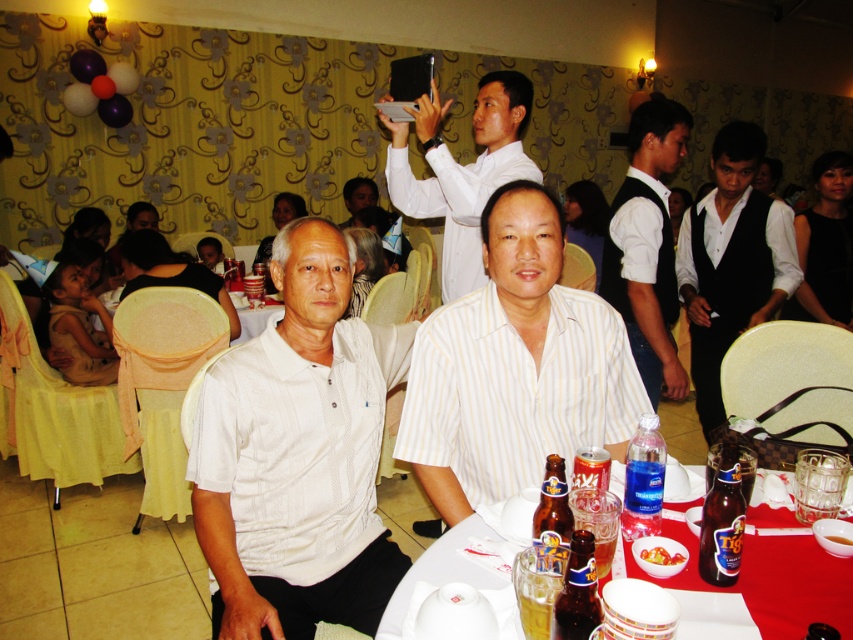
Between black satin vest at right and translucent plastic cups at lower center, which one has less height?

translucent plastic cups at lower center is shorter.

At what (x,y) coordinates should I click in order to perform the action: click on black satin vest at right. Please return your answer as a coordinate pair (x, y). The image size is (853, 640). Looking at the image, I should click on (730, 260).

Is white smooth shirt at upper center positioned behind shiny gold beer at table center?

Yes, white smooth shirt at upper center is behind shiny gold beer at table center.

Who is lower down, white smooth shirt at upper center or shiny gold beer at table center?

shiny gold beer at table center is lower down.

Find the location of `white smooth shirt at upper center`. white smooth shirt at upper center is located at coordinates (462, 172).

Which is behind, point (265, 429) or point (769, 634)?

Point (265, 429)

Does white textured polo shirt at center come behind translucent plastic cups at lower center?

That is True.

Is point (329, 445) more distant than point (833, 600)?

Yes, it is.

Where is `white textured polo shirt at center`? The width and height of the screenshot is (853, 640). white textured polo shirt at center is located at coordinates (299, 456).